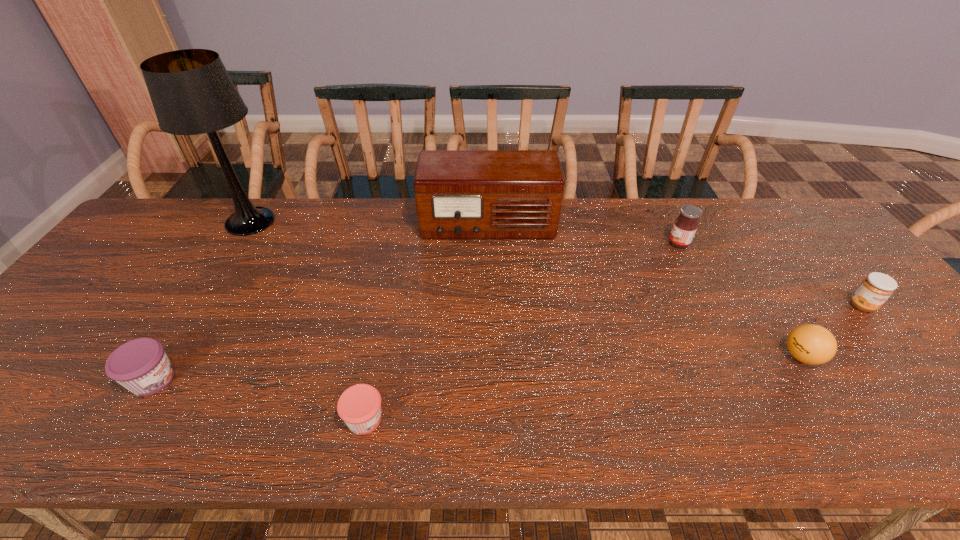
Where is `the third object from left to right`? This screenshot has width=960, height=540. the third object from left to right is located at coordinates (359, 406).

Where is `vacant space located on the left of the tallest object`? This screenshot has width=960, height=540. vacant space located on the left of the tallest object is located at coordinates (159, 222).

At what (x,y) coordinates should I click in order to perform the action: click on free space located 0.150m on the front-facing side of the fourth object from right to left. Please return your answer as a coordinate pair (x, y). The height and width of the screenshot is (540, 960). Looking at the image, I should click on (489, 280).

I want to click on vacant area located on the label side of the second jam from right to left, so click(651, 243).

You are a GUI agent. You are given a task and a screenshot of the screen. Output one action in this format:
    pyautogui.click(x=<x>, y=<y>)
    Task: Click on the vacant space located on the label side of the second jam from right to left
    The image size is (960, 540).
    Given the screenshot: What is the action you would take?
    pyautogui.click(x=574, y=243)

This screenshot has width=960, height=540. I want to click on blank space located 0.400m on the label side of the second jam from right to left, so click(535, 243).

Find the location of `vacant area situated 0.090m on the front label of the rightmost jam`. vacant area situated 0.090m on the front label of the rightmost jam is located at coordinates (894, 343).

Locate an element on the screen. The width and height of the screenshot is (960, 540). vacant area situated on the side with brand of the sixth object from left to right is located at coordinates (734, 356).

Identify the location of vacant area situated 0.360m on the side with brand of the sixth object from left to right. This screenshot has width=960, height=540. (627, 356).

The image size is (960, 540). I want to click on vacant space situated on the side with brand of the sixth object from left to right, so click(x=760, y=356).